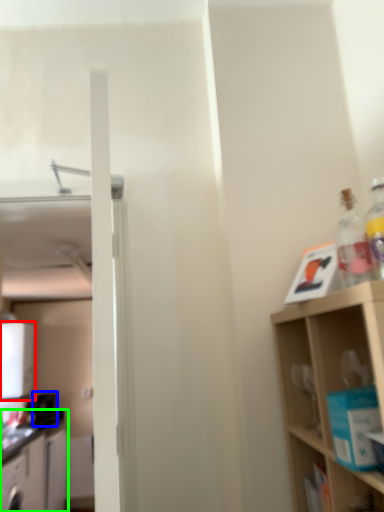
Question: Which object is positioned farthest from appliance (highlighted by a red box)? Select from appliance (highlighted by a blue box) and cabinetry (highlighted by a green box).

Choices:
 (A) appliance
 (B) cabinetry

Answer: (B)